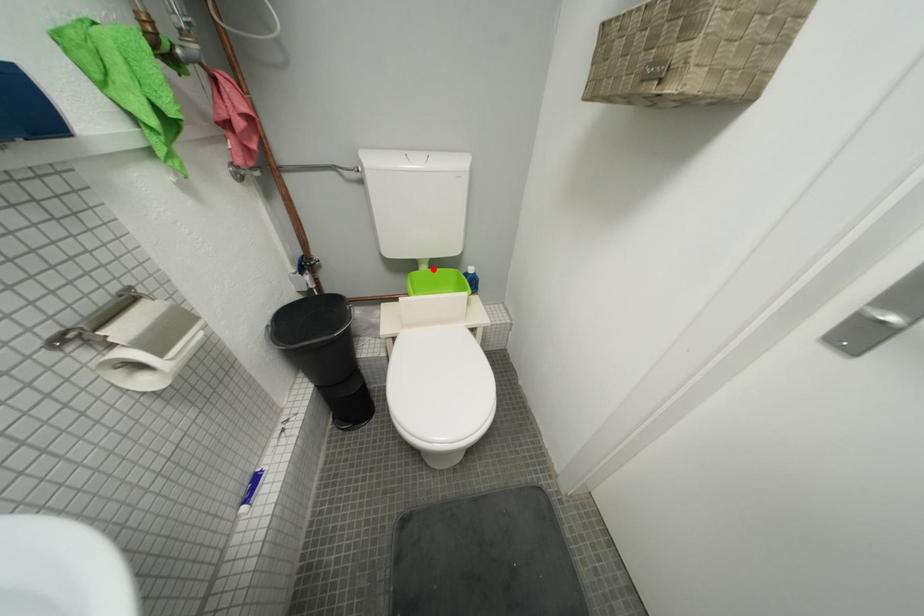
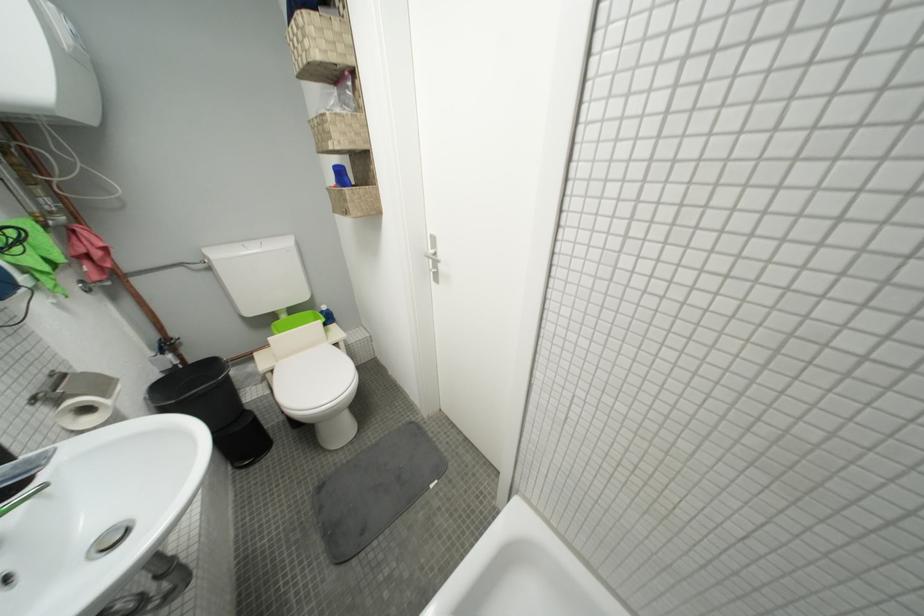
Where in the second image is the point corresponding to the highlighted location from the first image?

(293, 318)